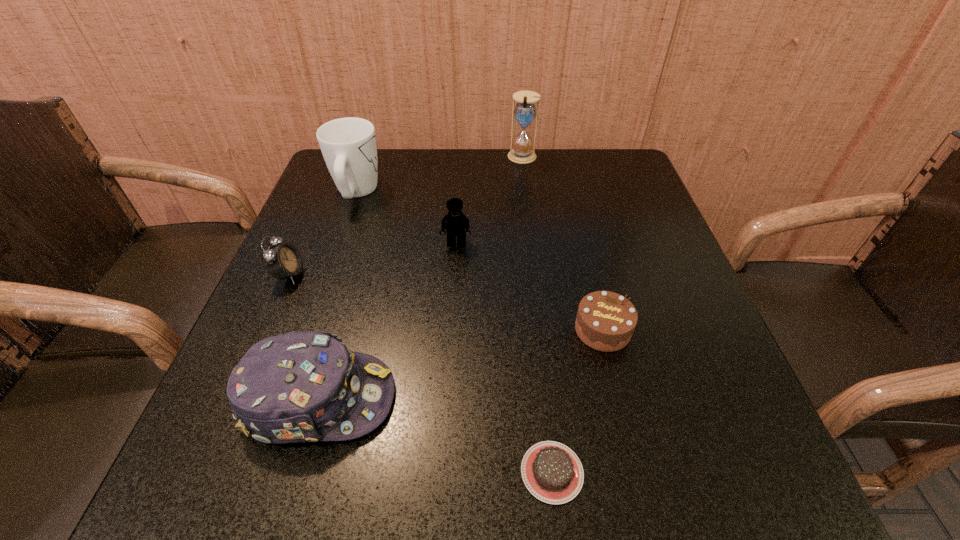
Locate an element on the screen. The image size is (960, 540). the tallest object is located at coordinates (525, 111).

Locate an element on the screen. the farthest object is located at coordinates (525, 111).

Where is `mug`? The image size is (960, 540). mug is located at coordinates (348, 145).

Where is `the sixth shortest object`? The height and width of the screenshot is (540, 960). the sixth shortest object is located at coordinates (348, 145).

Where is `the fourth object from right to left`? The image size is (960, 540). the fourth object from right to left is located at coordinates tap(455, 223).

Identify the location of Lego. Image resolution: width=960 pixels, height=540 pixels. (455, 223).

This screenshot has width=960, height=540. What are the coordinates of `headwear` in the screenshot? It's located at (297, 387).

What are the coordinates of `the fifth tallest object` in the screenshot? It's located at (282, 261).

Identify the location of the fourth farthest object. (282, 261).

You are a GUI agent. You are given a task and a screenshot of the screen. Output one action in this format:
    pyautogui.click(x=<x>, y=<y>)
    Task: Click on the rightmost object
    This screenshot has height=540, width=960.
    Given the screenshot: What is the action you would take?
    point(605,321)